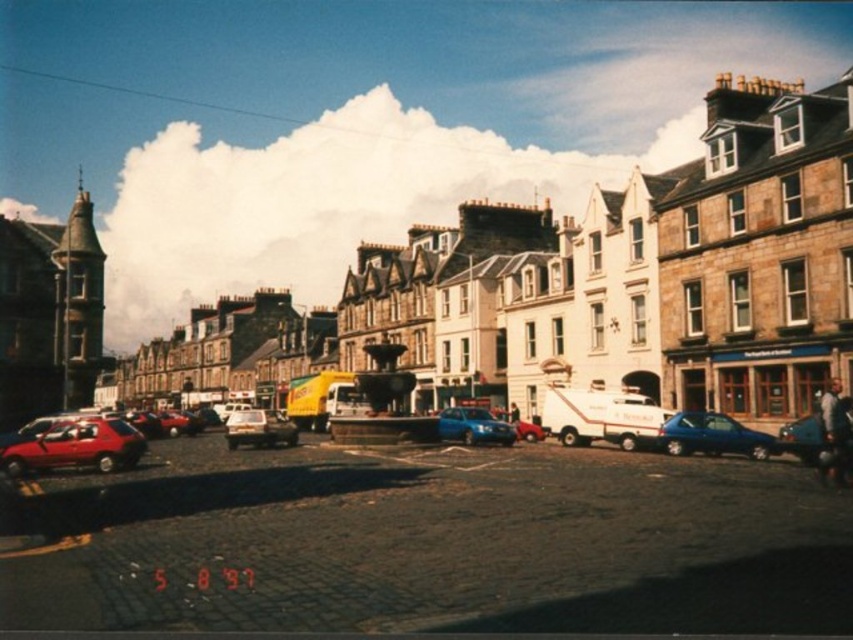
Locate an element on the screen. Image resolution: width=853 pixels, height=640 pixels. metallic blue hatchback at center is located at coordinates (712, 435).

Which is more to the left, metallic blue hatchback at center or blue metallic car at center?

blue metallic car at center

Image resolution: width=853 pixels, height=640 pixels. Find the location of `metallic blue hatchback at center`. metallic blue hatchback at center is located at coordinates (712, 435).

Locate an element on the screen. metallic blue hatchback at center is located at coordinates (712, 435).

Can you confirm if metallic blue hatchback at center is smaller than shiny silver car at center?

Yes, metallic blue hatchback at center is smaller than shiny silver car at center.

Measure the distance between point (756,449) and camera.

79.06 meters

Locate an element on the screen. metallic blue hatchback at center is located at coordinates (712, 435).

Does shiny silver car at center appear under shiny blue sedan at center?

Correct, shiny silver car at center is located below shiny blue sedan at center.

How distant is shiny silver car at center from shiny blue sedan at center?

A distance of 57.11 meters exists between shiny silver car at center and shiny blue sedan at center.

Which is in front, point (251, 442) or point (813, 438)?

Point (813, 438)

Locate an element on the screen. The image size is (853, 640). shiny silver car at center is located at coordinates (258, 428).